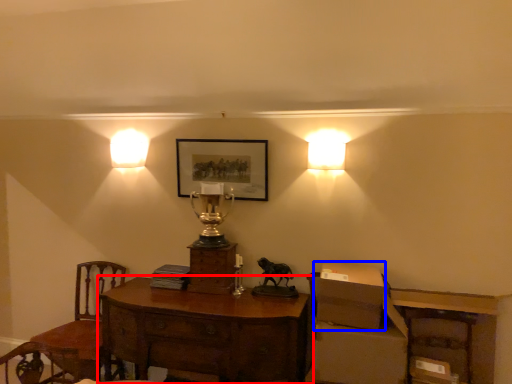
Question: Which of the following is the farthest to the observer, desk (highlighted by a red box) or cardboard box (highlighted by a blue box)?

Choices:
 (A) desk
 (B) cardboard box

Answer: (B)